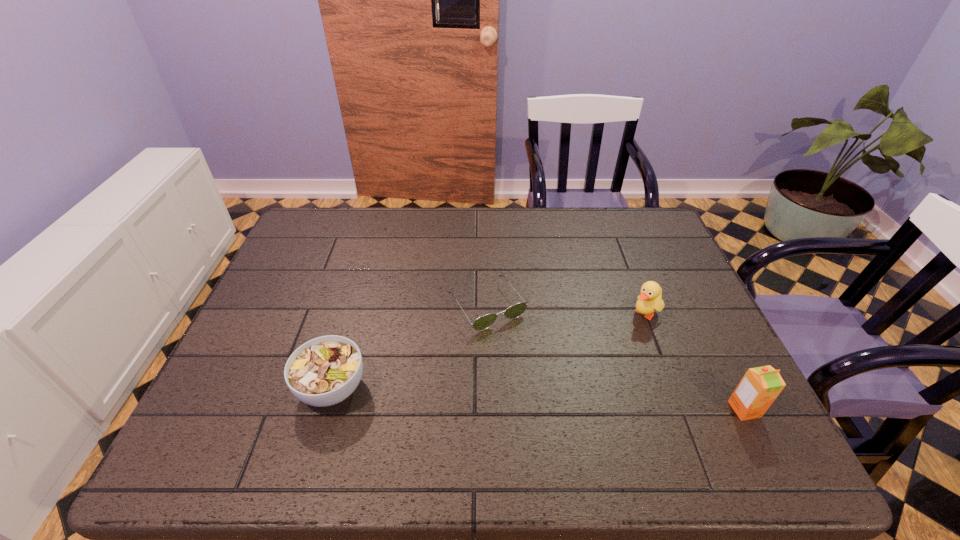
I want to click on free space located 0.400m on the front-facing side of the second tallest object, so click(523, 409).

The image size is (960, 540). What are the coordinates of `free space located on the front-facing side of the second tallest object` in the screenshot? It's located at (549, 388).

Where is `vacant region located on the front-facing side of the second tallest object`? Image resolution: width=960 pixels, height=540 pixels. vacant region located on the front-facing side of the second tallest object is located at coordinates (555, 383).

Find the location of a particular element. vacant space located on the front-facing side of the sunglasses is located at coordinates (548, 393).

Locate an element on the screen. blank area located on the front-facing side of the sunglasses is located at coordinates (559, 408).

Identify the location of vacant space situated 0.260m on the front-facing side of the sunglasses. This screenshot has height=540, width=960. (564, 415).

I want to click on soup bowl situated at the near edge, so click(x=324, y=371).

This screenshot has height=540, width=960. In order to click on orange juice located at the near edge in this screenshot , I will do pyautogui.click(x=760, y=386).

At what (x,y) coordinates should I click in order to perform the action: click on orange juice that is positioned at the right edge. Please return your answer as a coordinate pair (x, y). Image resolution: width=960 pixels, height=540 pixels. Looking at the image, I should click on (760, 386).

At what (x,y) coordinates should I click in order to perform the action: click on duckling at the right edge. Please return your answer as a coordinate pair (x, y). This screenshot has width=960, height=540. Looking at the image, I should click on (650, 299).